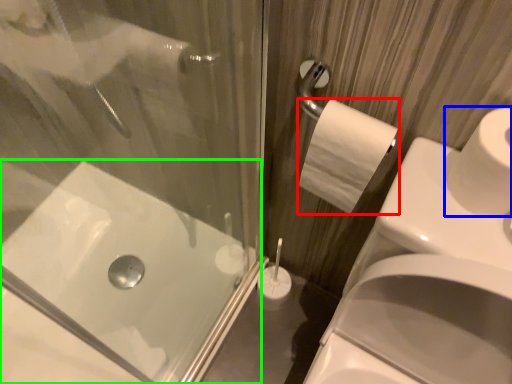
Question: Which is farther away from toilet paper (highlighted by a red box)? toilet paper (highlighted by a blue box) or bath (highlighted by a green box)?

Choices:
 (A) toilet paper
 (B) bath

Answer: (B)